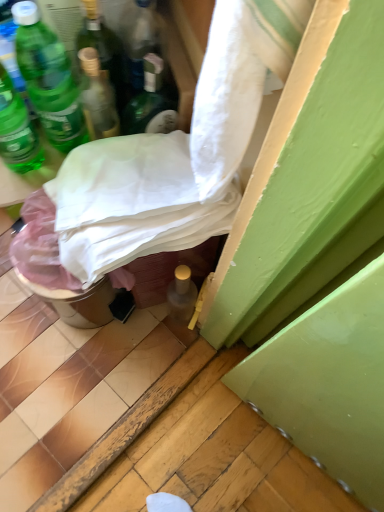
The width and height of the screenshot is (384, 512). What do you see at coordinates (48, 79) in the screenshot?
I see `green matte bottle at upper left, arranged as the 3th bottle when viewed from the right` at bounding box center [48, 79].

Find the location of a particular element. The width and height of the screenshot is (384, 512). white fabric at center is located at coordinates (174, 156).

Find the location of a particular element. metallic silver bucket at lower left is located at coordinates (56, 268).

Where is `green matte bottle at upper left, the 2th bottle positioned from the left`? green matte bottle at upper left, the 2th bottle positioned from the left is located at coordinates (9, 44).

Image resolution: width=384 pixels, height=512 pixels. What are the coordinates of `translucent glass bottle at upper center, marked as the fifth bottle in a left-to-right arrangement` in the screenshot? It's located at (150, 103).

Describe the element at coordinates (103, 49) in the screenshot. I see `green glass bottle at upper left, which is counted as the fourth bottle, starting from the left` at that location.

Locate an element on the screen. The height and width of the screenshot is (512, 384). green glass bottle at upper left, which appears as the 2th bottle when viewed from the right is located at coordinates (103, 49).

Where is `green glass bottle at upper left, the 1th bottle from the left`? Image resolution: width=384 pixels, height=512 pixels. green glass bottle at upper left, the 1th bottle from the left is located at coordinates (17, 130).

Locate an element on the screen. Image resolution: width=384 pixels, height=512 pixels. green matte bottle at upper left, the 3th bottle from the left is located at coordinates coord(48,79).

From a real-world perspective, count 4th bottles upward from the metallic silver bucket at lower left and point to it. Please provide its 2D coordinates.

[(48, 79)]

Which object is more forward, metallic silver bucket at lower left or green matte bottle at upper left, the 3th bottle from the left?

green matte bottle at upper left, the 3th bottle from the left, is in front.

From a real-world perspective, is metallic silver bucket at lower left on top of green matte bottle at upper left, arranged as the 3th bottle when viewed from the right?

→ Incorrect, from a real-world perspective, metallic silver bucket at lower left is lower than green matte bottle at upper left, arranged as the 3th bottle when viewed from the right.

Is metallic silver bucket at lower left next to green matte bottle at upper left, arranged as the 3th bottle when viewed from the right?

No, metallic silver bucket at lower left is not next to green matte bottle at upper left, arranged as the 3th bottle when viewed from the right.

Consider the image. In the image, is green glass bottle at upper left, which appears as the 2th bottle when viewed from the right, positioned in front of or behind white fabric at center?

green glass bottle at upper left, which appears as the 2th bottle when viewed from the right, is positioned farther from the viewer than white fabric at center.

Is green glass bottle at upper left, which appears as the 2th bottle when viewed from the right, wider or thinner than white fabric at center?

In the image, green glass bottle at upper left, which appears as the 2th bottle when viewed from the right, appears to be more narrow than white fabric at center.

Where is `the 2nd bottle to the left of the white fabric at center, counting from the anchor's position`? the 2nd bottle to the left of the white fabric at center, counting from the anchor's position is located at coordinates (103, 49).

Measure the distance from metallic silver bucket at lower left to green matte bottle at upper left, the 2th bottle positioned from the left.

29.74 centimeters.

How many degrees apart are the facing directions of metallic silver bucket at lower left and green matte bottle at upper left, which is the 4th bottle from right to left?

61 degrees.

From the image's perspective, is metallic silver bucket at lower left above or below green matte bottle at upper left, the 2th bottle positioned from the left?

metallic silver bucket at lower left is below green matte bottle at upper left, the 2th bottle positioned from the left.

Is metallic silver bucket at lower left facing towards green matte bottle at upper left, which is the 4th bottle from right to left?

No.

Which of these two, green glass bottle at upper left, the 5th bottle viewed from the right, or white fabric at center, stands shorter?

green glass bottle at upper left, the 5th bottle viewed from the right, is shorter.

Consider the image. Does green glass bottle at upper left, the 5th bottle viewed from the right, have a larger size compared to white fabric at center?

Incorrect, green glass bottle at upper left, the 5th bottle viewed from the right, is not larger than white fabric at center.

From the picture: Is green glass bottle at upper left, the 1th bottle from the left, outside of white fabric at center?

Yes, green glass bottle at upper left, the 1th bottle from the left, is located beyond the bounds of white fabric at center.

Can you confirm if green glass bottle at upper left, the 1th bottle from the left, is positioned to the left of white fabric at center?

Correct, you'll find green glass bottle at upper left, the 1th bottle from the left, to the left of white fabric at center.

From a real-world perspective, which object rests below the other?

From a 3D spatial view, green matte bottle at upper left, the 3th bottle from the left, is below.

Measure the distance between white fabric at center and green matte bottle at upper left, the 3th bottle from the left.

white fabric at center and green matte bottle at upper left, the 3th bottle from the left, are 8.31 inches apart from each other.

Does white fabric at center lie behind green matte bottle at upper left, arranged as the 3th bottle when viewed from the right?

No, it is in front of green matte bottle at upper left, arranged as the 3th bottle when viewed from the right.

Is white fabric at center positioned far away from green matte bottle at upper left, arranged as the 3th bottle when viewed from the right?

No.

From a real-world perspective, who is located lower, green matte bottle at upper left, which is the 4th bottle from right to left, or green glass bottle at upper left, which is counted as the fourth bottle, starting from the left?

green glass bottle at upper left, which is counted as the fourth bottle, starting from the left, is physically lower.

Is green matte bottle at upper left, which is the 4th bottle from right to left, outside of green glass bottle at upper left, which appears as the 2th bottle when viewed from the right?

That's correct, green matte bottle at upper left, which is the 4th bottle from right to left, is outside of green glass bottle at upper left, which appears as the 2th bottle when viewed from the right.

Looking at this image, considering the positions of objects green matte bottle at upper left, the 2th bottle positioned from the left, and green glass bottle at upper left, which is counted as the fourth bottle, starting from the left, in the image provided, who is more to the right, green matte bottle at upper left, the 2th bottle positioned from the left, or green glass bottle at upper left, which is counted as the fourth bottle, starting from the left,?

From the viewer's perspective, green glass bottle at upper left, which is counted as the fourth bottle, starting from the left, appears more on the right side.

Can you tell me how much green matte bottle at upper left, which is the 4th bottle from right to left, and green glass bottle at upper left, which is counted as the fourth bottle, starting from the left, differ in facing direction?

0.000464 degrees.

Considering the relative sizes of green matte bottle at upper left, arranged as the 3th bottle when viewed from the right, and green glass bottle at upper left, which is counted as the fourth bottle, starting from the left, in the image provided, is green matte bottle at upper left, arranged as the 3th bottle when viewed from the right, taller than green glass bottle at upper left, which is counted as the fourth bottle, starting from the left,?

Indeed, green matte bottle at upper left, arranged as the 3th bottle when viewed from the right, has a greater height compared to green glass bottle at upper left, which is counted as the fourth bottle, starting from the left.

In terms of size, does green matte bottle at upper left, arranged as the 3th bottle when viewed from the right, appear bigger or smaller than green glass bottle at upper left, which appears as the 2th bottle when viewed from the right?

In the image, green matte bottle at upper left, arranged as the 3th bottle when viewed from the right, appears to be larger than green glass bottle at upper left, which appears as the 2th bottle when viewed from the right.

From a real-world perspective, is green matte bottle at upper left, the 3th bottle from the left, beneath green glass bottle at upper left, which appears as the 2th bottle when viewed from the right?

No, from a real-world perspective, green matte bottle at upper left, the 3th bottle from the left, is not beneath green glass bottle at upper left, which appears as the 2th bottle when viewed from the right.

In order to click on bucket that appears on the left of green matte bottle at upper left, arranged as the 3th bottle when viewed from the right in this screenshot , I will do `click(56, 268)`.

The width and height of the screenshot is (384, 512). I want to click on bottle that is the 4th one when counting upward from the white fabric at center (from the image's perspective), so click(x=103, y=49).

Which object lies nearer to the anchor point green matte bottle at upper left, the 3th bottle from the left, green matte bottle at upper left, the 2th bottle positioned from the left, or metallic silver bucket at lower left?

green matte bottle at upper left, the 2th bottle positioned from the left, lies closer to green matte bottle at upper left, the 3th bottle from the left, than the other object.

From the image, which object appears to be nearer to green matte bottle at upper left, the 3th bottle from the left, white fabric at center or metallic silver bucket at lower left?

metallic silver bucket at lower left lies closer to green matte bottle at upper left, the 3th bottle from the left, than the other object.

When comparing their distances from green matte bottle at upper left, which is the 4th bottle from right to left, does white fabric at center or green glass bottle at upper left, the 1th bottle from the left, seem closer?

green glass bottle at upper left, the 1th bottle from the left, is positioned closer to the anchor green matte bottle at upper left, which is the 4th bottle from right to left.

From the image, which object appears to be farther from white fabric at center, green matte bottle at upper left, the 3th bottle from the left, or green glass bottle at upper left, the 5th bottle viewed from the right?

green glass bottle at upper left, the 5th bottle viewed from the right.

When comparing their distances from green matte bottle at upper left, the 2th bottle positioned from the left, does green glass bottle at upper left, the 5th bottle viewed from the right, or white fabric at center seem closer?

Among the two, green glass bottle at upper left, the 5th bottle viewed from the right, is located nearer to green matte bottle at upper left, the 2th bottle positioned from the left.

Based on their spatial positions, is metallic silver bucket at lower left or green matte bottle at upper left, arranged as the 3th bottle when viewed from the right, further from translucent glass bottle at upper center, the 1th bottle positioned from the right?

metallic silver bucket at lower left is positioned further to the anchor translucent glass bottle at upper center, the 1th bottle positioned from the right.

Based on their spatial positions, is green glass bottle at upper left, the 1th bottle from the left, or white fabric at center closer to metallic silver bucket at lower left?

green glass bottle at upper left, the 1th bottle from the left, lies closer to metallic silver bucket at lower left than the other object.

Based on their spatial positions, is metallic silver bucket at lower left or green glass bottle at upper left, which appears as the 2th bottle when viewed from the right, further from translucent glass bottle at upper center, marked as the fifth bottle in a left-to-right arrangement?

metallic silver bucket at lower left lies further to translucent glass bottle at upper center, marked as the fifth bottle in a left-to-right arrangement, than the other object.

The width and height of the screenshot is (384, 512). Identify the location of bottle between green matte bottle at upper left, the 3th bottle from the left, and metallic silver bucket at lower left vertically. (17, 130).

Find the location of a particular element. bottle between green matte bottle at upper left, arranged as the 3th bottle when viewed from the right, and translucent glass bottle at upper center, marked as the fifth bottle in a left-to-right arrangement, from left to right is located at coordinates (103, 49).